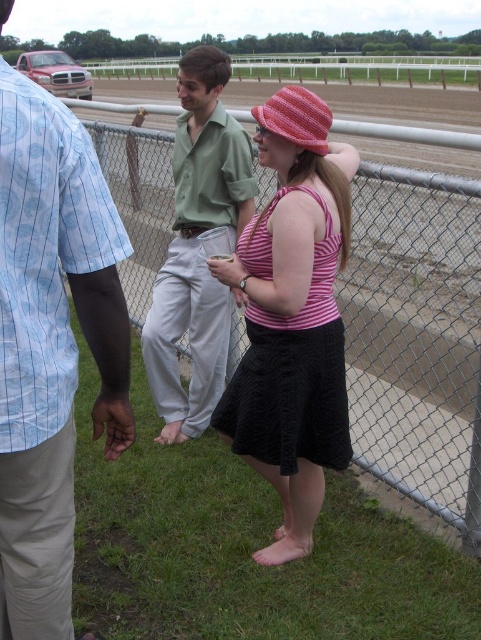
Between metal chain-link fence at center and pink striped tank top at center, which one has less height?

metal chain-link fence at center

Does metal chain-link fence at center lie in front of pink striped tank top at center?

No, it is not.

Measure the distance between point (372,305) and camera.

A distance of 12.39 feet exists between point (372,305) and camera.

You are a GUI agent. You are given a task and a screenshot of the screen. Output one action in this format:
    pyautogui.click(x=<x>, y=<y>)
    Task: Click on the metal chain-link fence at center
    The image size is (481, 640).
    Given the screenshot: What is the action you would take?
    pyautogui.click(x=417, y=339)

Between light blue striped shirt at left and pink knitted hat at center, which one appears on the right side from the viewer's perspective?

pink knitted hat at center is more to the right.

Who is shorter, light blue striped shirt at left or pink knitted hat at center?

pink knitted hat at center

Where is `light blue striped shirt at left`? The image size is (481, 640). light blue striped shirt at left is located at coordinates pos(50,346).

Identify the location of light blue striped shirt at left. The height and width of the screenshot is (640, 481). (50, 346).

Can you confirm if green cotton shirt at center is positioned to the left of pink knitted hat at center?

Yes, green cotton shirt at center is to the left of pink knitted hat at center.

Between point (165, 298) and point (316, 145), which one is positioned behind?

The point (165, 298) is behind.

Where is `green cotton shirt at center`? green cotton shirt at center is located at coordinates (198, 248).